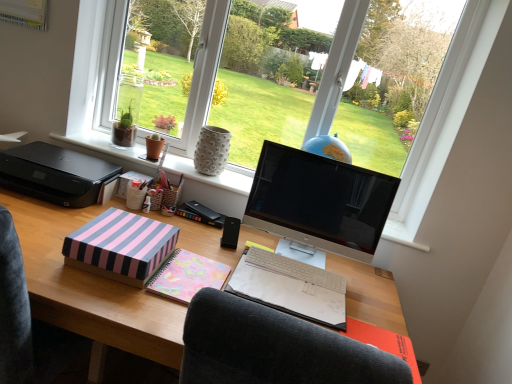
Where is `blank space to the left of black plastic speaker at center`? blank space to the left of black plastic speaker at center is located at coordinates pos(200,233).